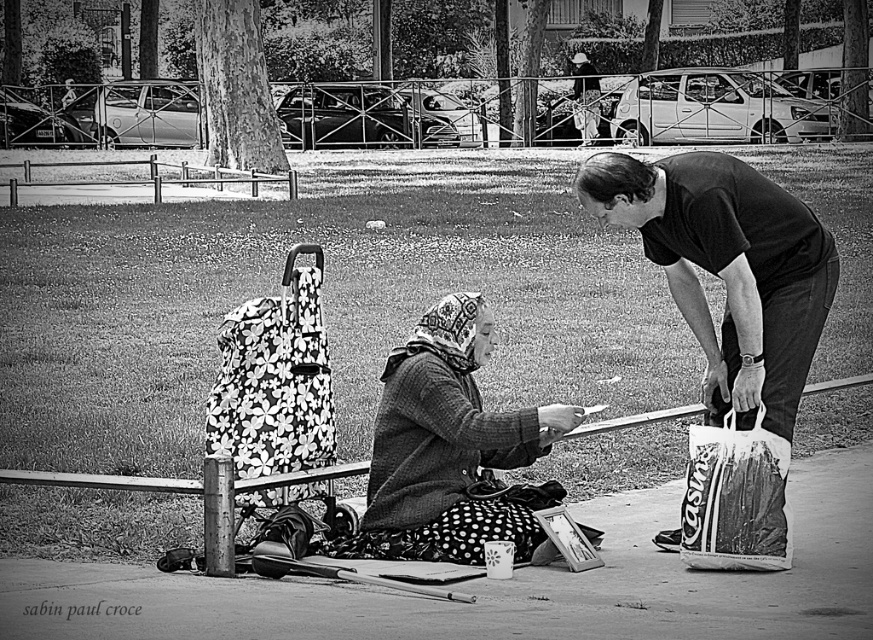
You are a photographer trying to capture a closeup of the floral fabric baby carriage at left and the white plastic bag at lower right. Since you want both items in focus, you need to know which one is closer to the camera. Based on the scene, can you determine which object is nearer to the camera?

The floral fabric baby carriage at left is taller than the white plastic bag at lower right, so it is likely closer to the camera.

You are a photographer trying to capture a closeup shot of both the knitted woolen scarf at center and the floral fabric baby carriage at left without moving either object. Given that your camera can only focus on objects within a 24 inch range, will you be able to get both in focus?

The knitted woolen scarf at center and the floral fabric baby carriage at left are 26.87 inches apart from each other. Since the distance between them exceeds the camera focus range of 24 inches, you won not be able to capture both in focus simultaneously.